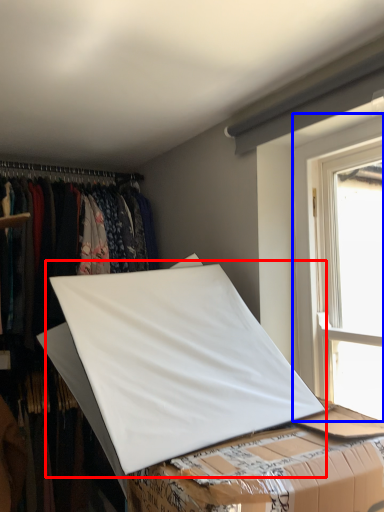
Question: Which object is further to the camera taking this photo, linen (highlighted by a red box) or window (highlighted by a blue box)?

Choices:
 (A) linen
 (B) window

Answer: (B)